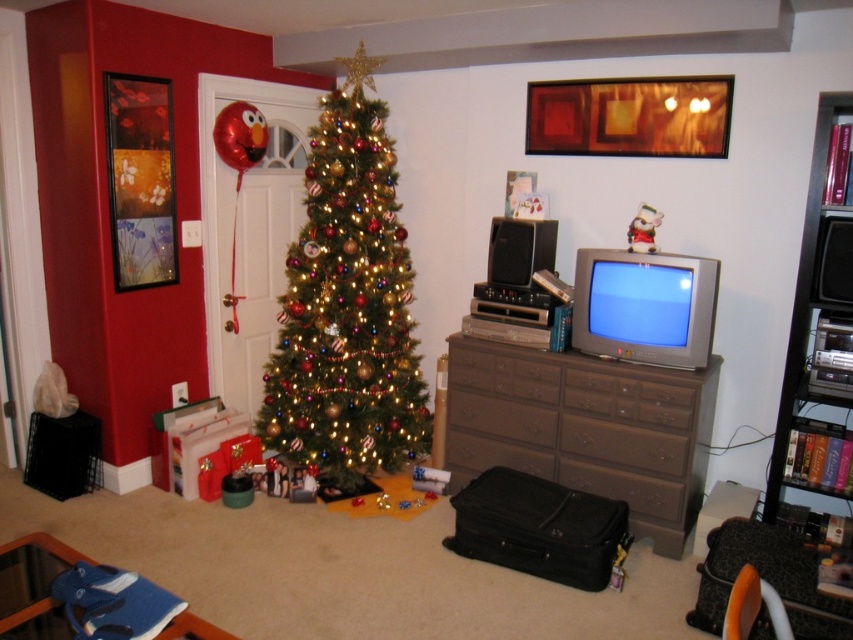
You are a delivery person trying to place a large package on the surface between the shiny gold christmas tree at center and the brown matte dresser at center. Can you fit the package there?

The shiny gold christmas tree at center is thinner than the brown matte dresser at center, so the space between them may be sufficient to place the large package.

You are standing in the living room and want to place a new decoration on the brown matte dresser at center. To reach it, you need to walk around the shiny gold christmas tree at center. In which direction should you move relative to the tree?

You should move to the right of the shiny gold christmas tree at center to reach the brown matte dresser at center because the dresser is located to the right of the tree.

From the picture: You are standing in the living room and want to place a new decoration between the two points labeled point (x=515, y=384) and point (x=641, y=214). Since you can only place it in front of one of these points, which point should you choose to ensure the decoration is closer to the Christmas tree?

You should place the decoration in front of point (x=641, y=214) because point (x=515, y=384) is behind point (x=641, y=214), so placing it in front of the latter would be closer to the Christmas tree.